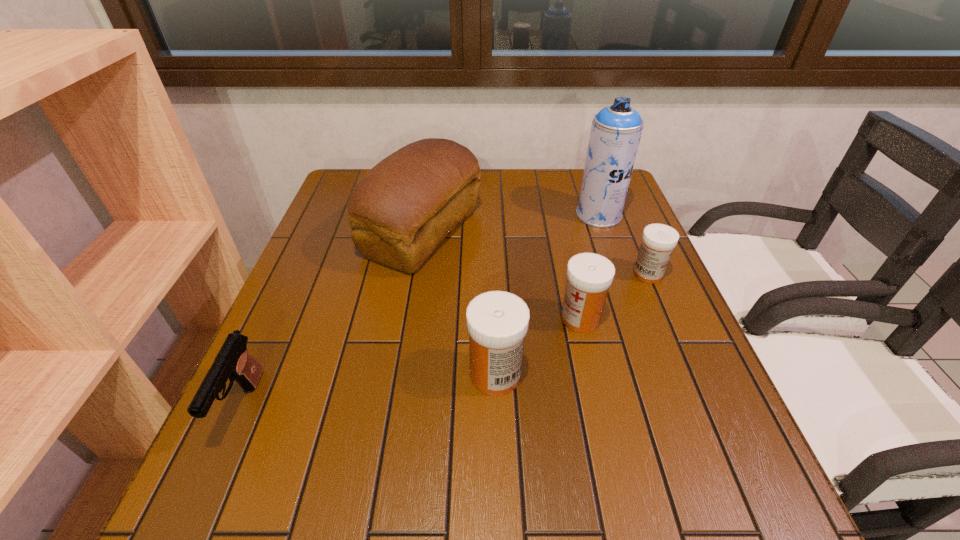
I want to click on vacant space positioned on the front of the rightmost medicine, so click(x=687, y=367).

Identify the location of vacant space located on the left of the tallest object. This screenshot has width=960, height=540. (507, 215).

Locate an element on the screen. blank area located on the front of the bread is located at coordinates (410, 312).

Where is `aerosol can that is at the far edge`? Image resolution: width=960 pixels, height=540 pixels. aerosol can that is at the far edge is located at coordinates [616, 130].

You are a GUI agent. You are given a task and a screenshot of the screen. Output one action in this format:
    pyautogui.click(x=<x>, y=<y>)
    Task: Click on the bread located in the far edge section of the desktop
    The height and width of the screenshot is (540, 960).
    Given the screenshot: What is the action you would take?
    pyautogui.click(x=400, y=210)

Image resolution: width=960 pixels, height=540 pixels. I want to click on object that is at the near edge, so [x=233, y=361].

This screenshot has height=540, width=960. In order to click on bread situated at the left edge in this screenshot , I will do `click(400, 210)`.

Identify the location of pistol present at the left edge. Image resolution: width=960 pixels, height=540 pixels. coord(233,361).

What are the coordinates of `medicine that is positioned at the right edge` in the screenshot? It's located at (658, 240).

Where is `aerosol can that is positioned at the right edge`? The width and height of the screenshot is (960, 540). aerosol can that is positioned at the right edge is located at coordinates (616, 130).